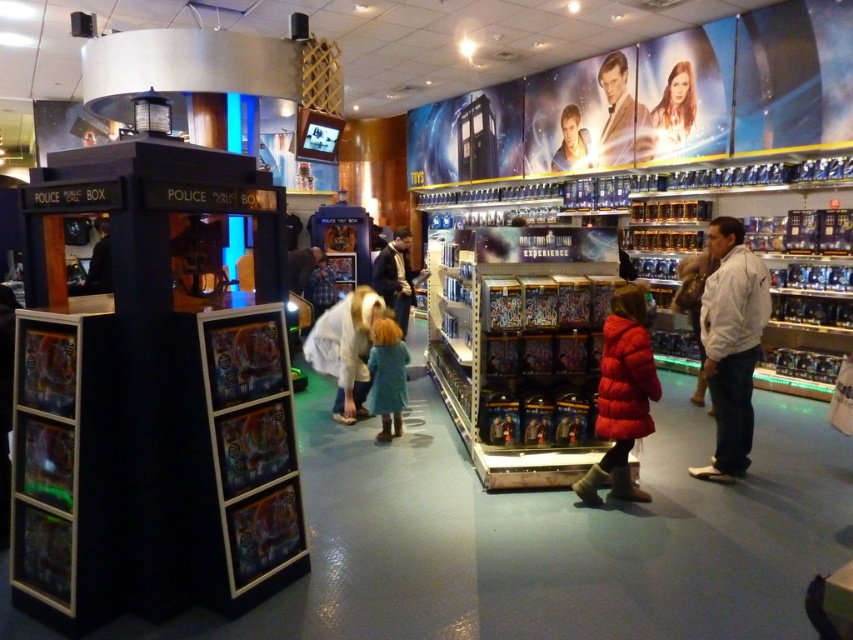
Looking at this image, you are a customer in the store looking for a specific Doctor Who costume. You see the smooth tan suit at upper center and the blue fuzzy coat at center. Which one is positioned more to the right side of the store?

The smooth tan suit at upper center is positioned more to the right side of the store compared to the blue fuzzy coat at center.

In the scene shown: You are a customer in the store looking for a jacket that reaches down to your knees. You see the white fleece jacket at right and the matte black jacket at center. Which jacket is more likely to be knee length?

The white fleece jacket at right is taller than the matte black jacket at center, so it is more likely to be knee length.

You are a customer in the Doctor Who merchandise store. You see two points marked in the image. The first point is at coordinate point [728,278] and the second point is at coordinate point [94,272]. If you are standing at the entrance of the store, which point is closer to you?

Point [728,278] is in front of point [94,272], so if you are standing at the entrance, point [728,278] is closer to you.